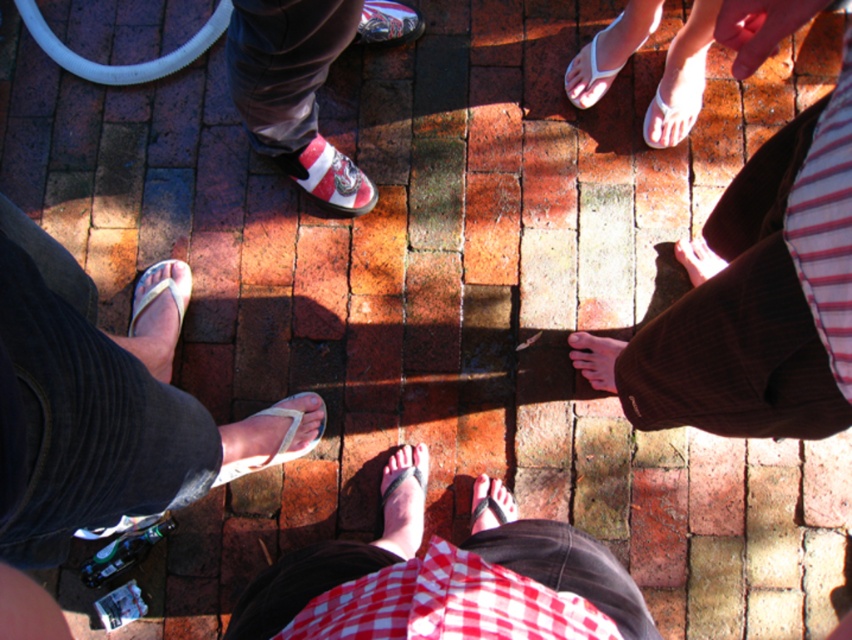
You are an artist sketching the scene from above. You notice the smooth skin hand at upper right and the shiny metallic shoe at center. Which object appears smaller in your drawing?

The smooth skin hand at upper right appears smaller because it is not as tall as the shiny metallic shoe at center.